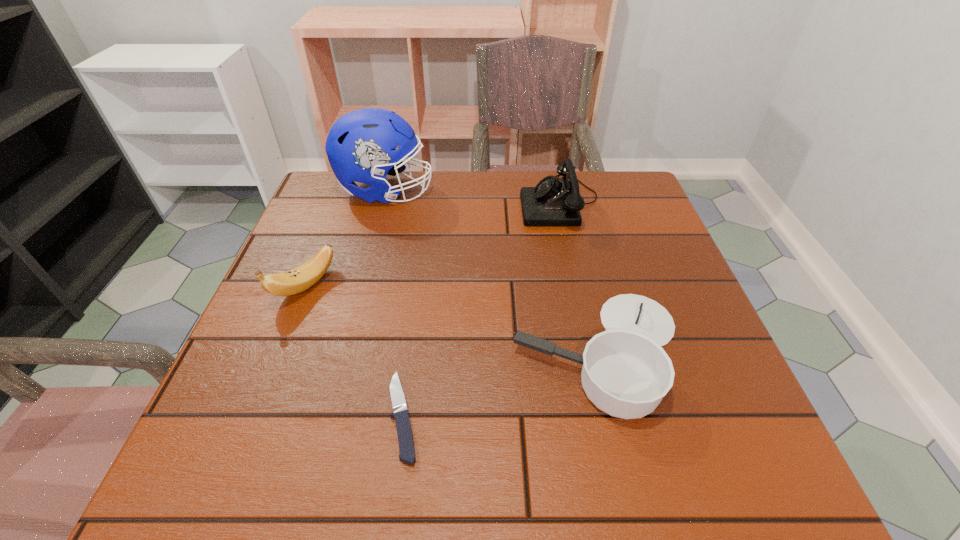
This screenshot has width=960, height=540. I want to click on object that is at the far right corner, so click(554, 201).

The height and width of the screenshot is (540, 960). Find the location of `vacant space at the far edge`. vacant space at the far edge is located at coordinates (449, 172).

I want to click on free spot at the near edge of the desktop, so click(433, 450).

I want to click on vacant space at the left edge of the desktop, so click(x=327, y=339).

The image size is (960, 540). I want to click on vacant space at the right edge of the desktop, so 653,234.

This screenshot has width=960, height=540. What are the coordinates of `vacant region at the far left corner of the desktop` in the screenshot? It's located at click(330, 181).

Find the location of a particular element. The image size is (960, 540). vacant region at the far right corner of the desktop is located at coordinates (580, 170).

Find the location of a particular element. The height and width of the screenshot is (540, 960). vacant space at the near right corner of the desktop is located at coordinates (673, 433).

Find the location of a particular element. Image resolution: width=960 pixels, height=540 pixels. vacant space that's between the shortest object and the telephone is located at coordinates (482, 309).

Locate an element on the screen. This screenshot has height=540, width=960. blank region between the fourth tallest object and the steak knife is located at coordinates (501, 384).